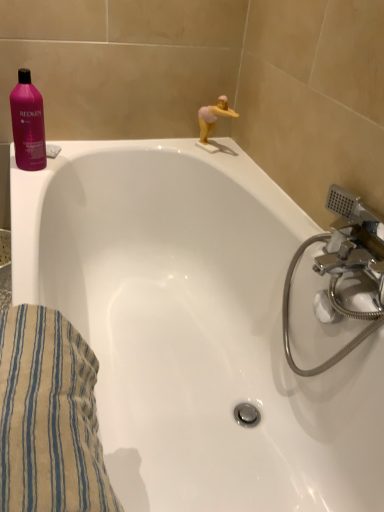
In order to click on vacant point to the left of pink rubber duck at upper right in this screenshot , I will do click(x=183, y=143).